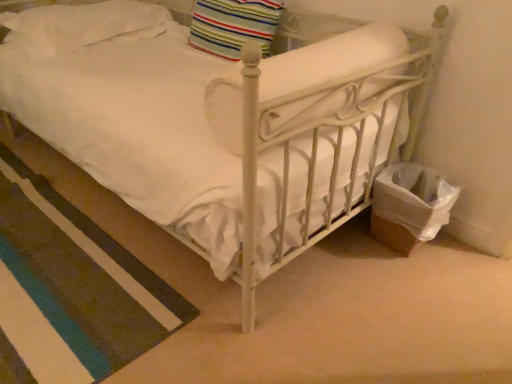
In order to click on free space to the right of white soft rug at lower left in this screenshot , I will do `click(256, 286)`.